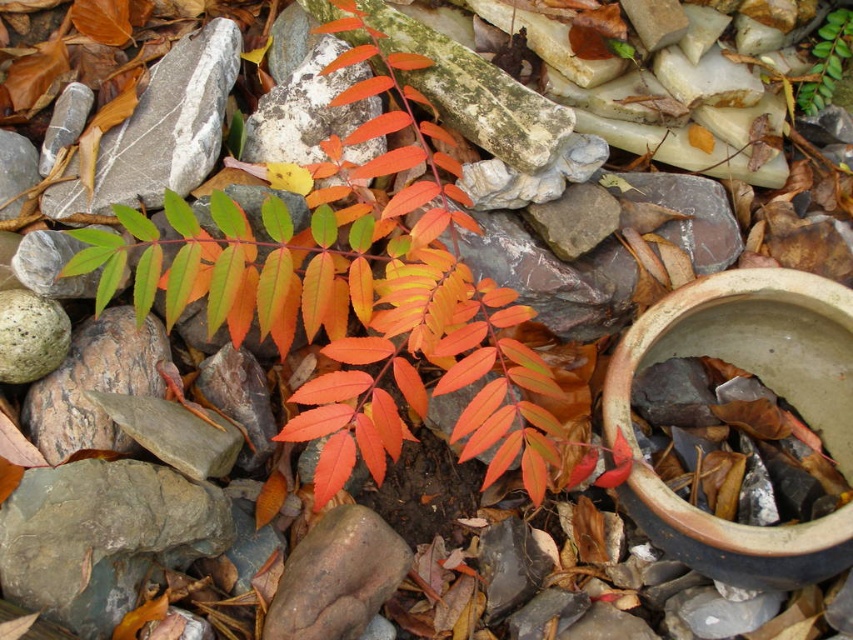
You are a gardener who wants to place a small statue between the bright orange leaves at center and the green matte leaf at upper center. The statue requires a minimum of 1 meter of space between the two leaves to be placed safely. Can you place the statue there?

The bright orange leaves at center and green matte leaf at upper center are 96.92 centimeters apart, which is less than 1 meter. Therefore, the statue cannot be placed there safely due to insufficient space.